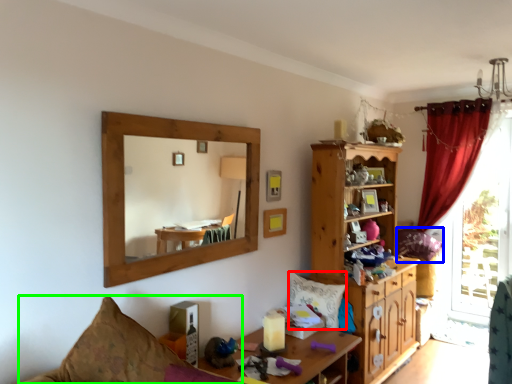
Question: Estimate the real-world distances between objects in this image. Which object is farther from pillow (highlighted by a red box), pillow (highlighted by a blue box) or couch (highlighted by a green box)?

Choices:
 (A) pillow
 (B) couch

Answer: (B)